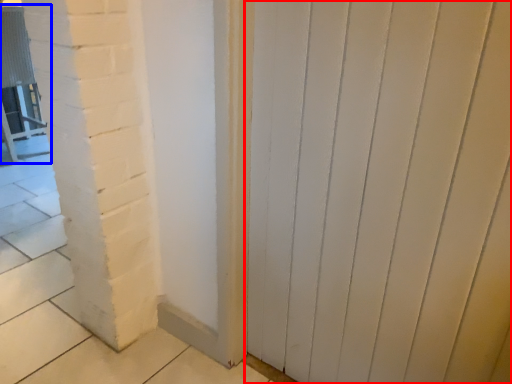
Question: Which point is further to the camera, door (highlighted by a red box) or chair (highlighted by a blue box)?

Choices:
 (A) door
 (B) chair

Answer: (B)